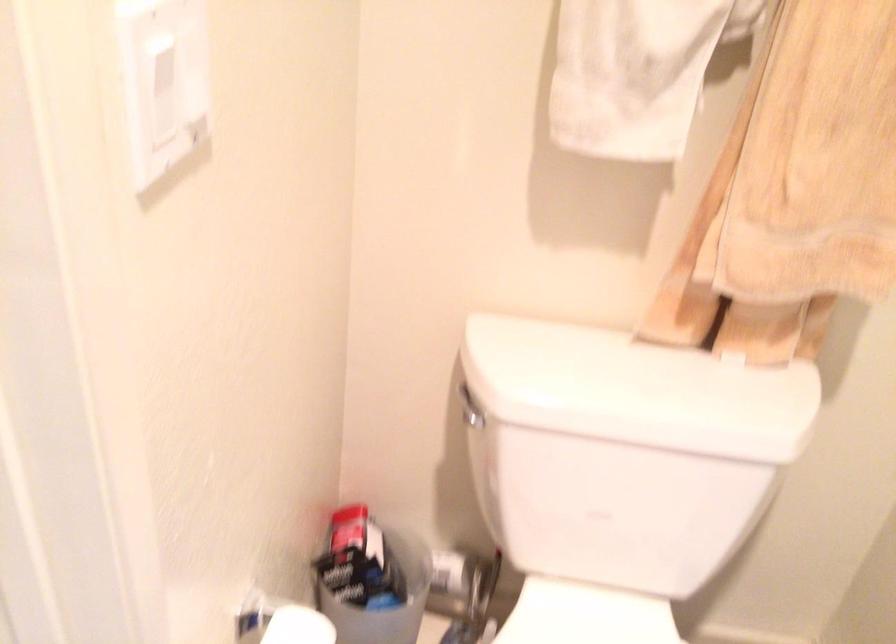
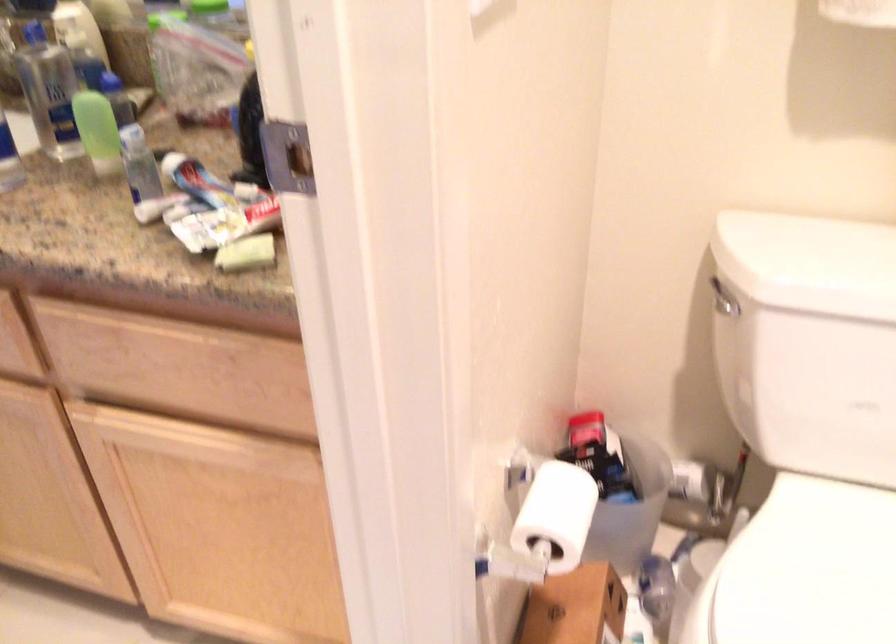
Where in the second image is the point corresponding to [547,375] from the first image?

(810, 263)